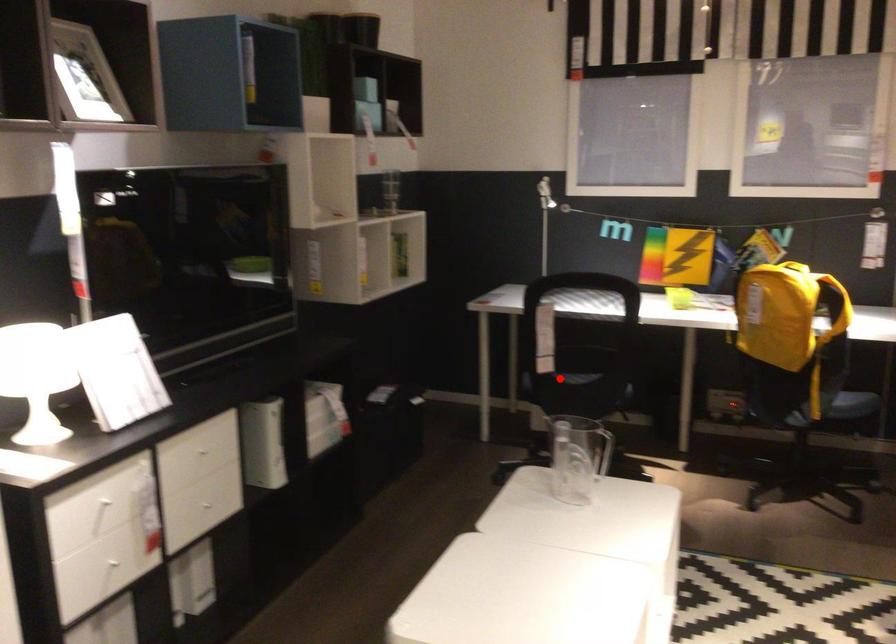
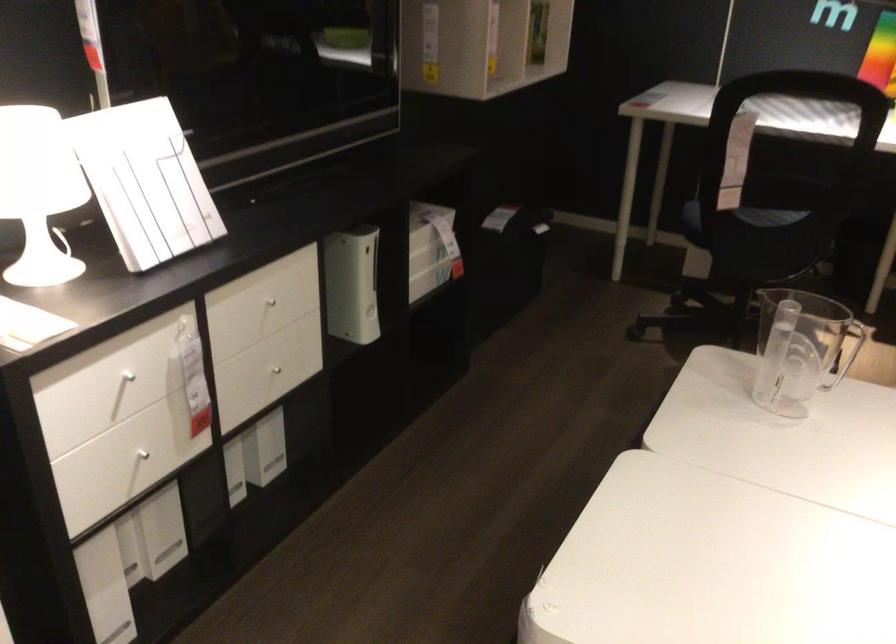
Locate, in the second image, the point that corresponds to the highlighted location in the first image.

(739, 218)